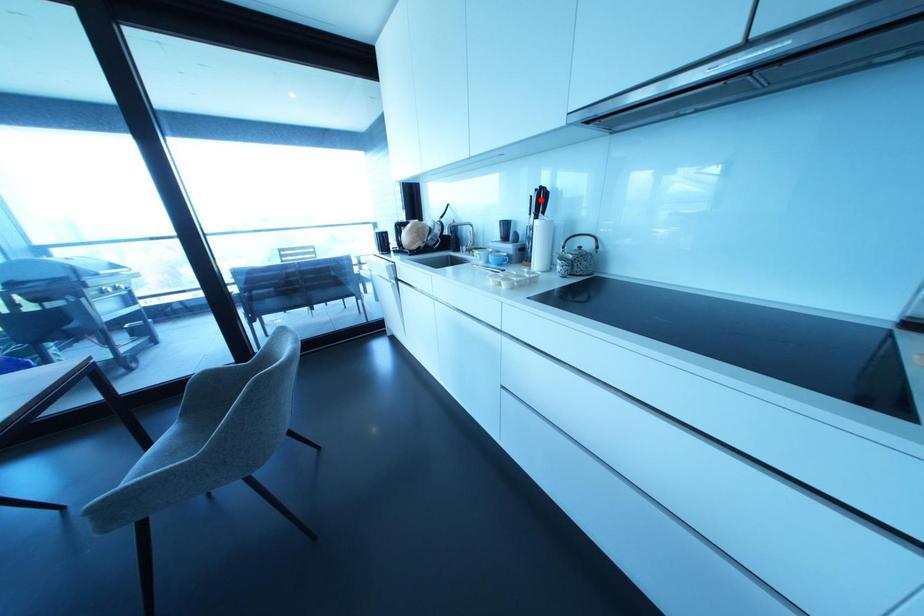
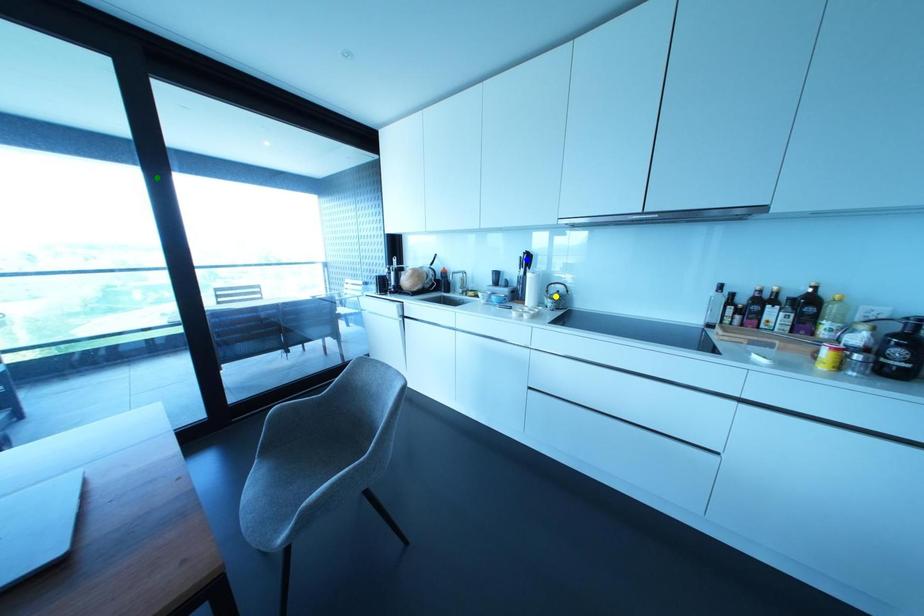
Question: I am providing you with two images of the same scene from different viewpoints. A red point is marked on the first image. You are given multiple points on the second image. Which mark in image 2 goes with the point in image 1?

Choices:
 (A) green point
 (B) blue point
 (C) yellow point

Answer: (B)